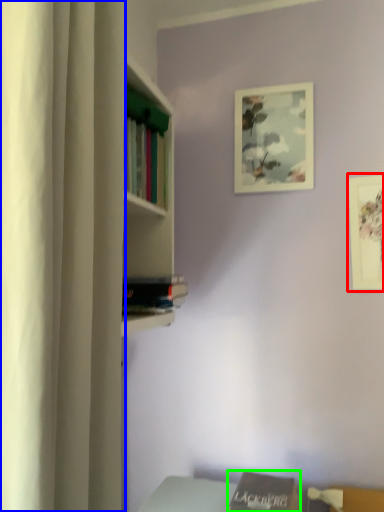
Question: Which object is positioned closest to picture frame (highlighted by a red box)? Select from curtain (highlighted by a blue box) and book (highlighted by a green box).

Choices:
 (A) curtain
 (B) book

Answer: (B)